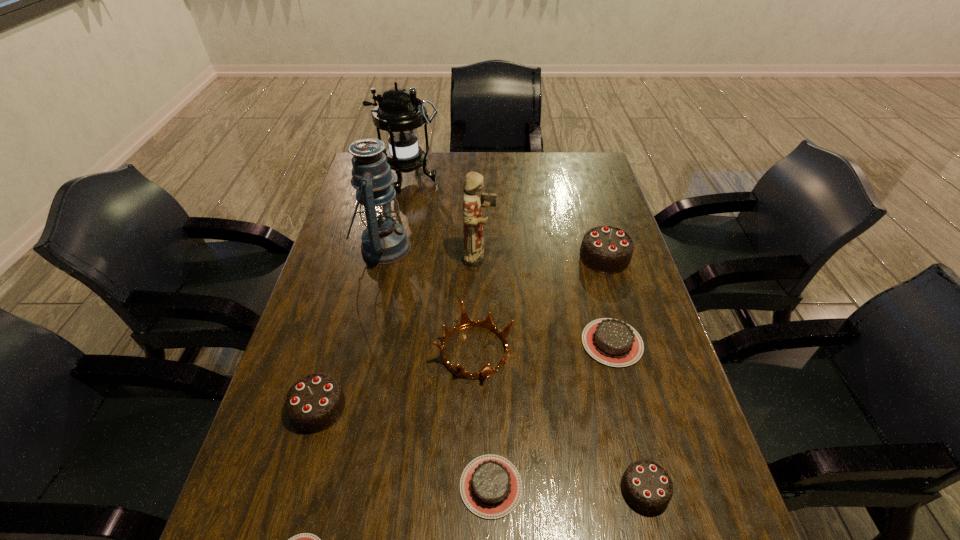
You are a GUI agent. You are given a task and a screenshot of the screen. Output one action in this format:
    pyautogui.click(x=<x>, y=<y>)
    Task: Click on the blank region between the gold crown and the biggest brown chocolate cake
    
    Given the screenshot: What is the action you would take?
    pyautogui.click(x=543, y=347)

Identify the location of vacant area between the second biggest chocolate chocolate cake and the eighth shortest object. The image size is (960, 540). (399, 333).

Find the location of a particular element. Image resolution: width=960 pixels, height=540 pixels. unoccupied area between the second farthest chocolate cake and the black lantern is located at coordinates (510, 261).

Locate an element on the screen. The width and height of the screenshot is (960, 540). free point between the farthest chocolate cake and the figurine is located at coordinates (542, 257).

Identify the location of vacant area that lies between the gold crown and the figurine. (477, 304).

Find the location of a particular element. vacant space that is in between the crown and the tallest chocolate cake is located at coordinates (540, 304).

Locate which object is the third closest to the nearest object. Please provide its 2D coordinates. Your answer should be formatted as a tuple, i.e. [(x, y)], where the tuple contains the x and y coordinates of a point satisfying the conditions above.

[(465, 322)]

Find the location of a particular element. This screenshot has height=540, width=960. object that ranks as the eighth closest to the third tallest chocolate cake is located at coordinates (384, 241).

Identify the location of chocolate cake that can be found as the fifth closest to the fourth tallest object. (305, 539).

Locate which chocolate cake ranks in proximity to the farthest chocolate cake. Please provide its 2D coordinates. Your answer should be formatted as a tuple, i.e. [(x, y)], where the tuple contains the x and y coordinates of a point satisfying the conditions above.

[(612, 342)]